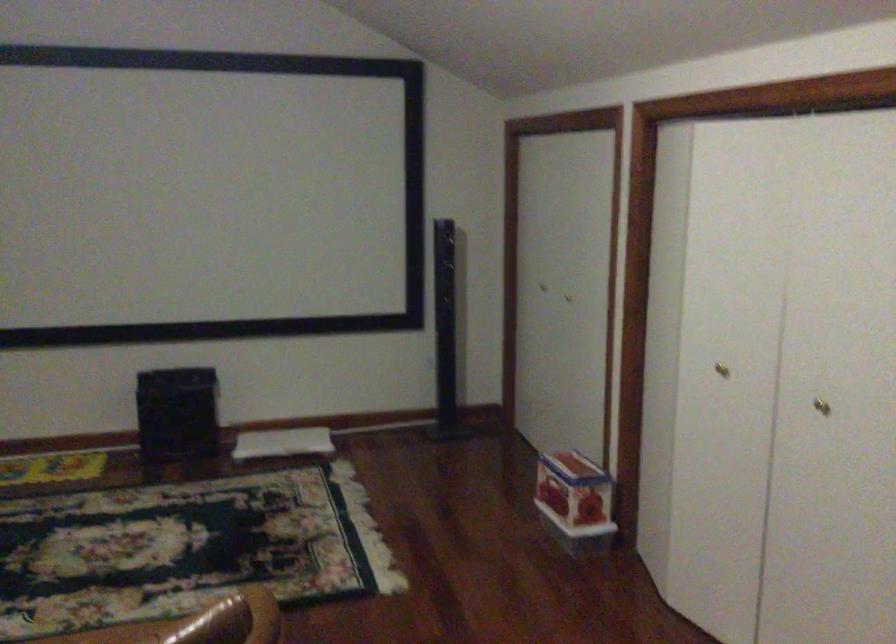
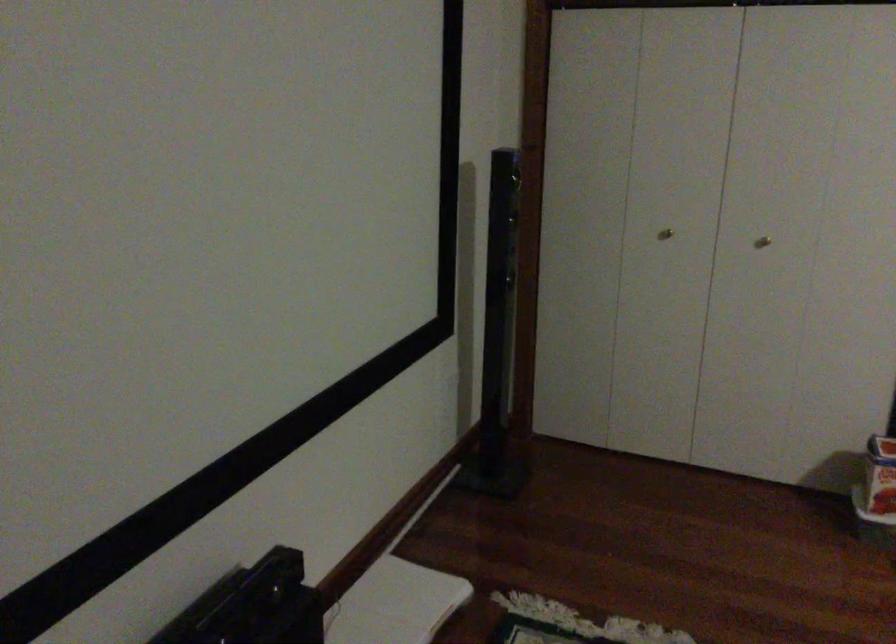
Find the pixel in the second image that matches point 291,438 in the first image.

(394, 603)